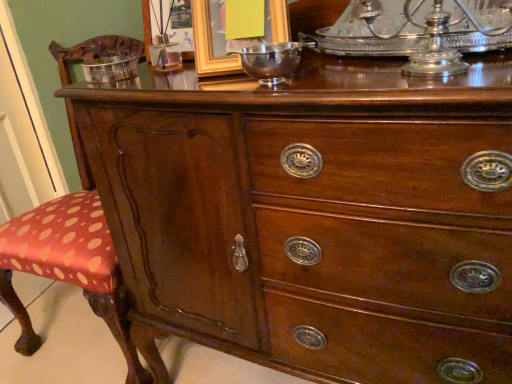
The height and width of the screenshot is (384, 512). I want to click on blank space to the left of shiny silver bowl at center, so click(x=193, y=87).